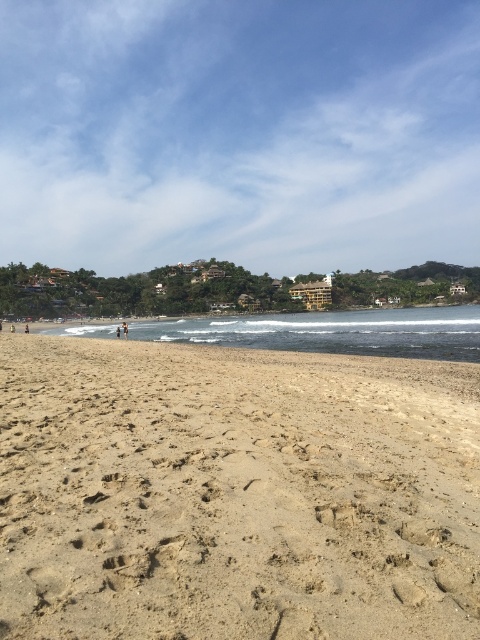
Question: Which point is closer to the camera?

Choices:
 (A) clear blue water at center
 (B) tan skin person at center

Answer: (A)

Question: Does tan skin person at center have a larger size compared to tan sand at lower left?

Choices:
 (A) yes
 (B) no

Answer: (A)

Question: From the image, what is the correct spatial relationship of light brown sandy beach at lower left in relation to tan skin person at center?

Choices:
 (A) above
 (B) below

Answer: (B)

Question: Which of the following is the closest to the observer?

Choices:
 (A) tan sand at lower left
 (B) light brown sandy beach at lower left
 (C) brown sand at lower left

Answer: (B)

Question: Which point is farther to the camera?

Choices:
 (A) (420, 310)
 (B) (25, 326)
 (C) (11, 323)
 (D) (71, 509)

Answer: (A)

Question: Does tan skin person at center appear under tan sand at lower left?

Choices:
 (A) no
 (B) yes

Answer: (A)